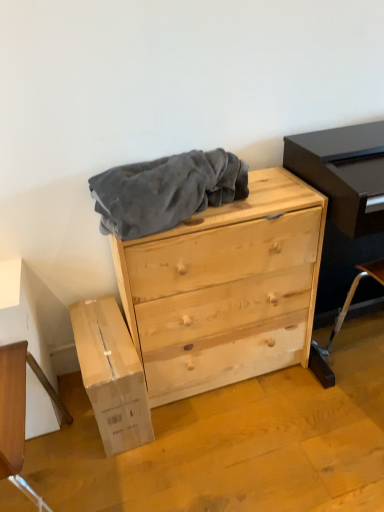
Image resolution: width=384 pixels, height=512 pixels. What are the coordinates of `vacant space in front of white cardboard box at lower left` in the screenshot? It's located at (105, 475).